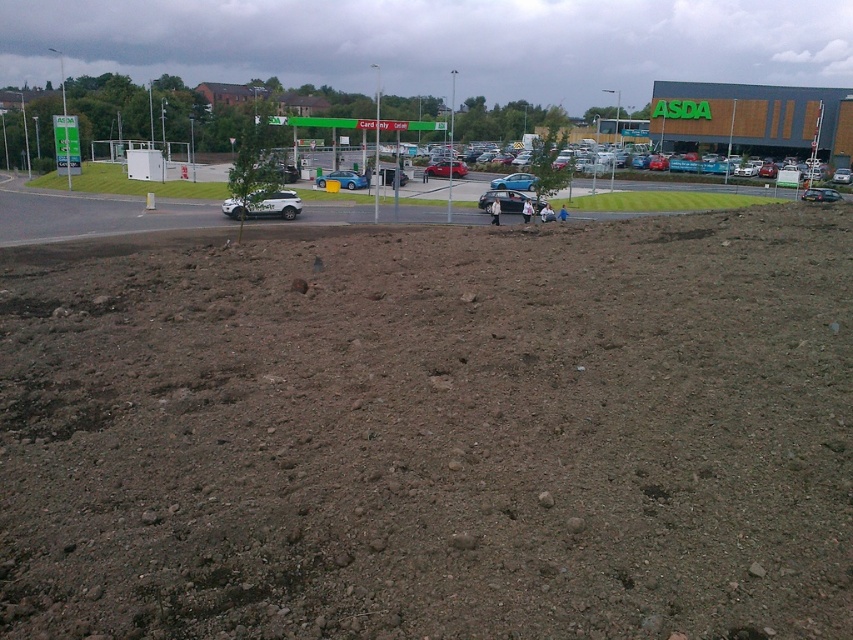
Between dull brown soil at center and satin black car at center, which one appears on the right side from the viewer's perspective?

Positioned to the right is satin black car at center.

Based on the photo, which is below, dull brown soil at center or satin black car at center?

Positioned lower is dull brown soil at center.

Between point (503, 260) and point (512, 200), which one is positioned behind?

Positioned behind is point (512, 200).

Find the location of a particular element. dull brown soil at center is located at coordinates (436, 435).

Can you confirm if metallic silver car at center is positioned to the right of metallic blue sedan at center?

Incorrect, metallic silver car at center is not on the right side of metallic blue sedan at center.

Is point (360, 184) positioned after point (515, 177)?

No, (360, 184) is closer to viewer.

The height and width of the screenshot is (640, 853). In order to click on metallic silver car at center in this screenshot , I will do `click(343, 179)`.

Between white matte car at center and satin black car at center, which one is positioned lower?

white matte car at center is lower down.

Does point (265, 211) lie in front of point (486, 195)?

Yes.

Locate an element on the screen. Image resolution: width=853 pixels, height=640 pixels. white matte car at center is located at coordinates (264, 205).

Where is `white matte car at center`? white matte car at center is located at coordinates (264, 205).